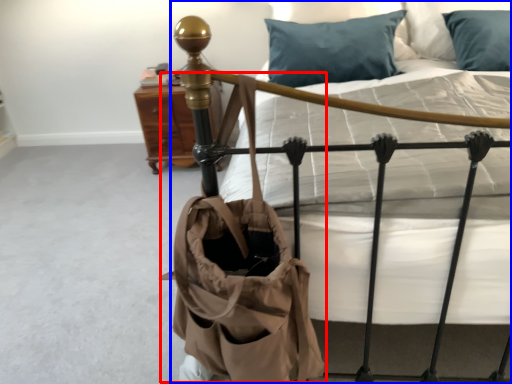
Question: Which object is closer to the camera taking this photo, shoulder bag (highlighted by a red box) or bed (highlighted by a blue box)?

Choices:
 (A) shoulder bag
 (B) bed

Answer: (A)